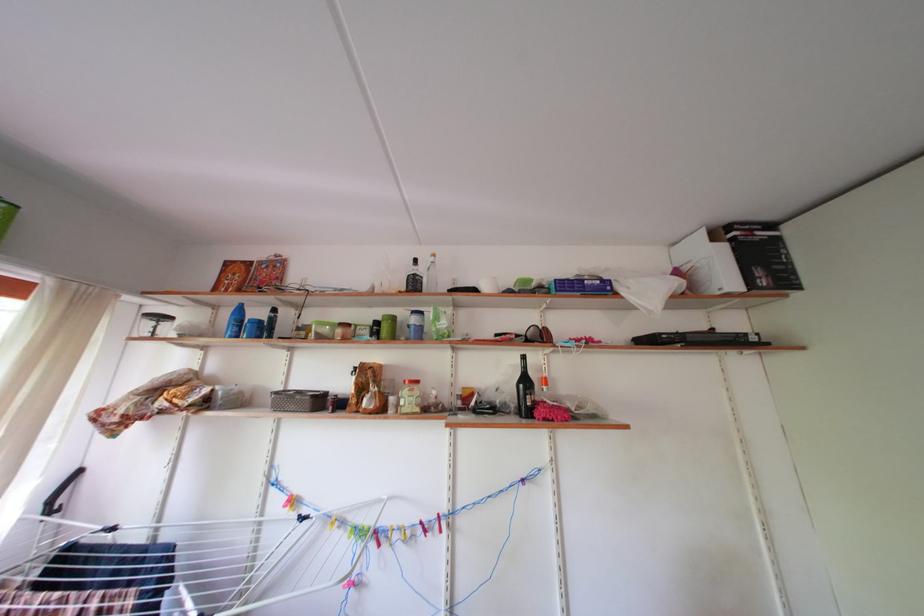
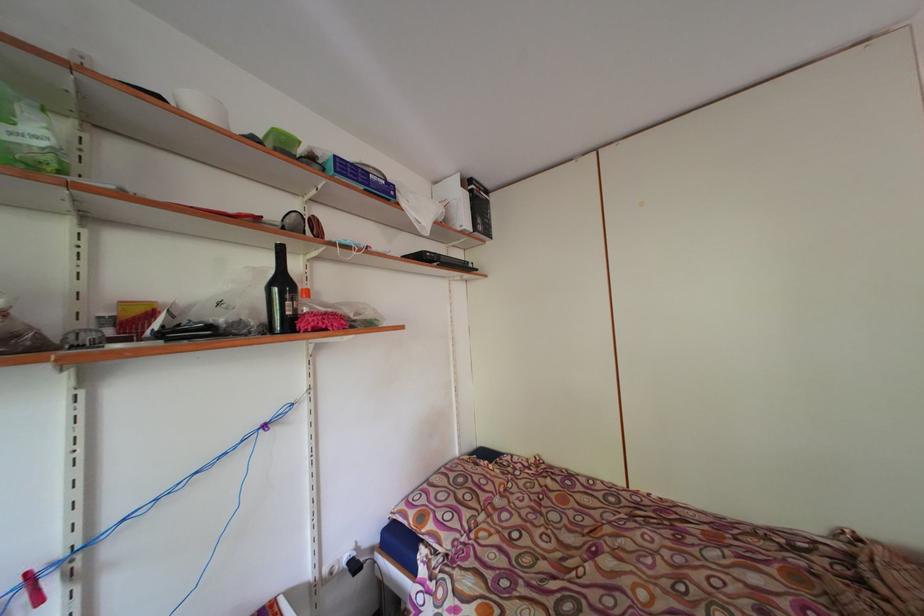
Find the pixel in the second image that matches (x=476, y=399) in the first image.

(144, 317)